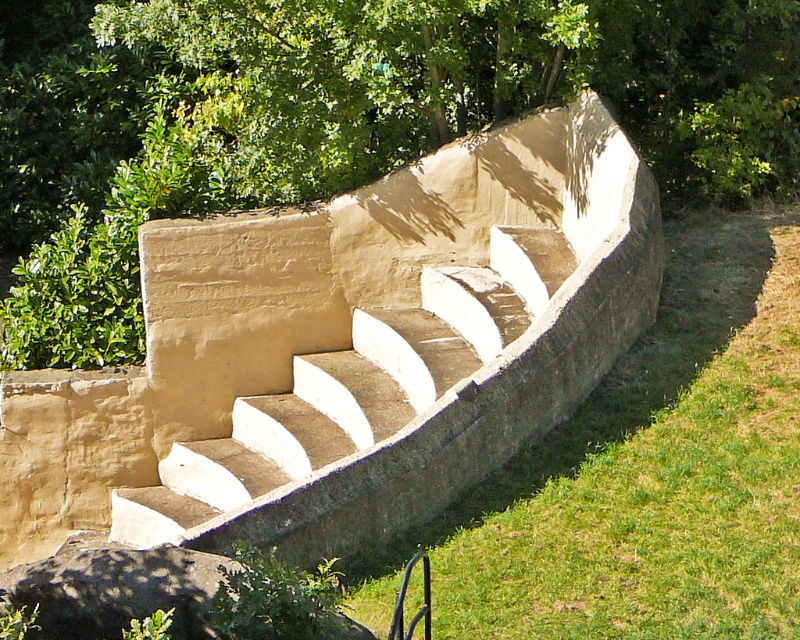
Question: Where is green grass at lower right located in relation to beige concrete stairs at center in the image?

Choices:
 (A) left
 (B) right

Answer: (B)

Question: Based on their relative distances, which object is nearer to the beige concrete stairs at center?

Choices:
 (A) green leafy tree at upper center
 (B) green grass at lower right

Answer: (A)

Question: Which point appears closest to the camera in this image?

Choices:
 (A) (454, 628)
 (B) (90, 364)
 (C) (506, 257)

Answer: (A)

Question: Considering the relative positions of green grass at lower right and beige concrete stairs at center in the image provided, where is green grass at lower right located with respect to beige concrete stairs at center?

Choices:
 (A) right
 (B) left

Answer: (A)

Question: Based on their relative distances, which object is nearer to the beige concrete stairs at center?

Choices:
 (A) green leafy tree at upper center
 (B) green grass at lower right

Answer: (A)

Question: Does green leafy tree at upper center appear on the right side of beige concrete stairs at center?

Choices:
 (A) yes
 (B) no

Answer: (B)